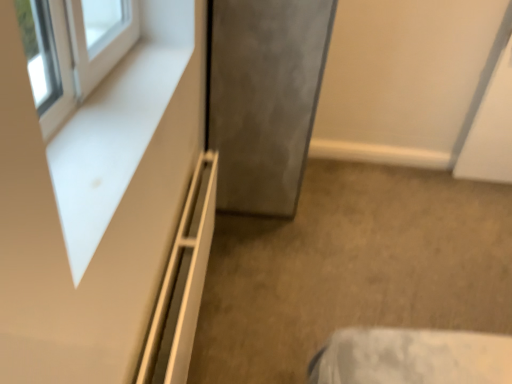
Question: Is white matte shelf at lower left at the back of satin gray door at center?

Choices:
 (A) no
 (B) yes

Answer: (A)

Question: Can you see satin gray door at center touching white matte shelf at lower left?

Choices:
 (A) no
 (B) yes

Answer: (A)

Question: Could you tell me if satin gray door at center is facing white matte shelf at lower left?

Choices:
 (A) no
 (B) yes

Answer: (A)

Question: From a real-world perspective, does satin gray door at center stand above white matte shelf at lower left?

Choices:
 (A) no
 (B) yes

Answer: (B)

Question: Can you confirm if satin gray door at center is bigger than white matte shelf at lower left?

Choices:
 (A) no
 (B) yes

Answer: (B)

Question: From the image's perspective, is satin gray door at center on white matte shelf at lower left?

Choices:
 (A) yes
 (B) no

Answer: (A)

Question: Are white matte dresser at upper left and white matte shelf at lower left located far from each other?

Choices:
 (A) no
 (B) yes

Answer: (A)

Question: Is white matte dresser at upper left shorter than white matte shelf at lower left?

Choices:
 (A) no
 (B) yes

Answer: (B)

Question: Can you confirm if white matte dresser at upper left is bigger than white matte shelf at lower left?

Choices:
 (A) no
 (B) yes

Answer: (A)

Question: Does white matte dresser at upper left lie in front of white matte shelf at lower left?

Choices:
 (A) no
 (B) yes

Answer: (B)

Question: From a real-world perspective, is white matte dresser at upper left over white matte shelf at lower left?

Choices:
 (A) yes
 (B) no

Answer: (A)

Question: Considering the relative sizes of white matte dresser at upper left and white matte shelf at lower left in the image provided, is white matte dresser at upper left wider than white matte shelf at lower left?

Choices:
 (A) yes
 (B) no

Answer: (A)

Question: Considering the relative sizes of white matte shelf at lower left and white matte dresser at upper left in the image provided, is white matte shelf at lower left thinner than white matte dresser at upper left?

Choices:
 (A) yes
 (B) no

Answer: (A)